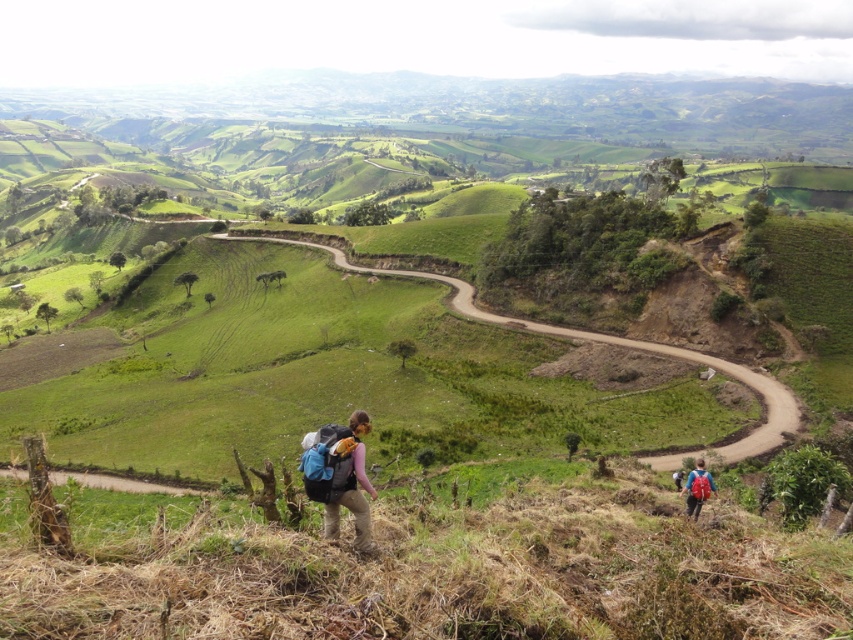
You are a hiker standing at the starting point of the trail and see the two matte blue backpacks in the scene. How far apart are the matte blue backpack at center and the matte blue backpack at lower right?

The matte blue backpack at center is 16.66 meters away from the matte blue backpack at lower right.